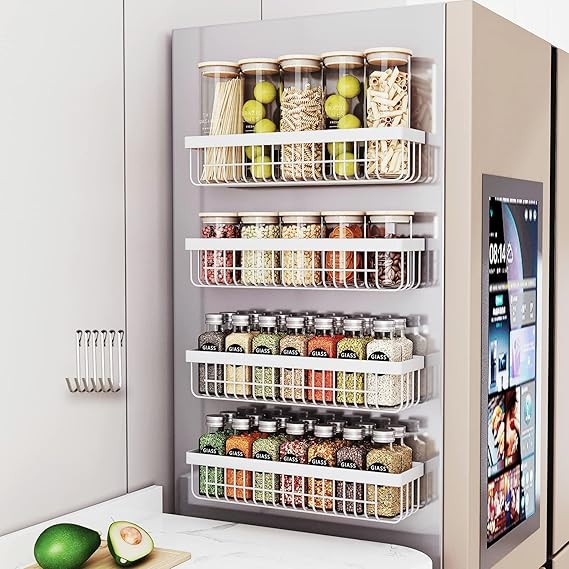
At what (x,y) coordinates should I click in order to perform the action: click on number of shelves. Please return your answer as a coordinate pair (x, y). The width and height of the screenshot is (569, 569). Looking at the image, I should click on (349, 145), (315, 263), (310, 384), (302, 485).